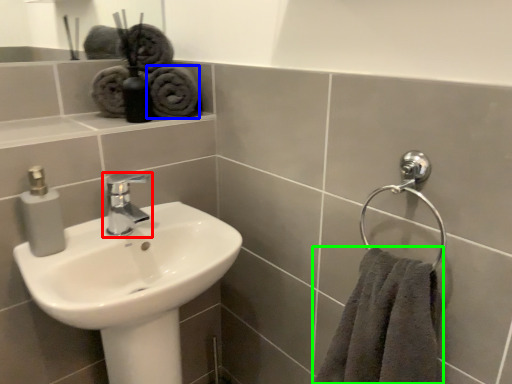
Question: Which object is positioned farthest from tap (highlighted by a red box)? Select from material (highlighted by a blue box) and towel (highlighted by a green box).

Choices:
 (A) material
 (B) towel

Answer: (B)